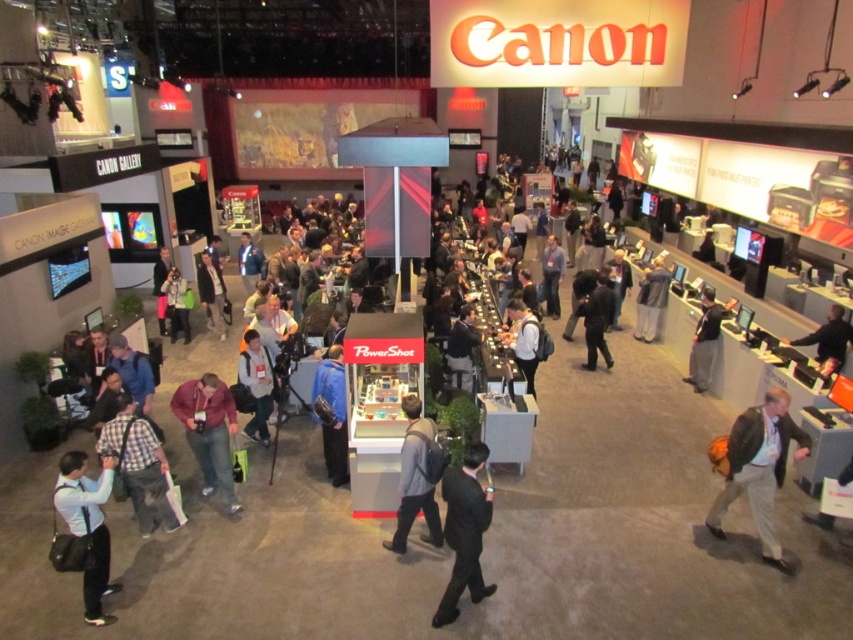
You are a photographer at the Canon exhibition. You need to capture a photo of the Canon PowerShot display in the foreground. However, two people are blocking your view. The light blue shirt at lower left and the blue fabric shirt at center are in your way. Which person should you ask to move first to clear the path to the display?

You should ask the light blue shirt at lower left to move first because they occupy less space and are closer to the display, making it easier to clear the path.

You are an event organizer at the Canon exhibition hall and need to arrange a photo shoot. You notice two attendees wearing dark gray jackets. One is wearing a dark gray fabric jacket at lower right and the other has a dark gray jacket at center. Which attendee should you choose if you want someone with a shorter jacket to ensure better visibility in the group photo?

The dark gray fabric jacket at lower right has a lesser height compared to the dark gray jacket at center, so you should choose the attendee wearing the dark gray fabric jacket at lower right for better visibility in the group photo.

You are an event organizer at the Canon exhibition hall. You need to determine if there is enough space to move between the dark gray fabric jacket at lower right and the dark gray jacket at center. Can you fit through the space between them?

The dark gray fabric jacket at lower right occupies less space than dark gray jacket at center, so there should be sufficient space to move between them. However, the exact width isn not specified, so it depends on the required clearance.